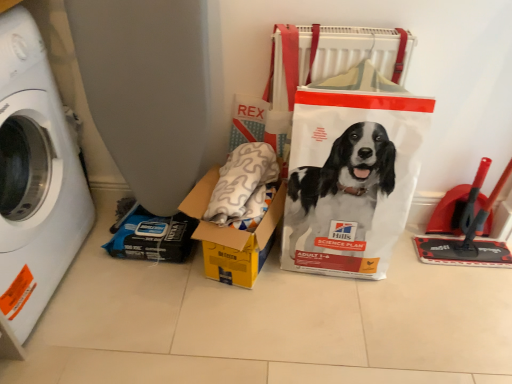
You are a GUI agent. You are given a task and a screenshot of the screen. Output one action in this format:
    pyautogui.click(x=<x>, y=<y>)
    Task: Click on the white plastic bag at center
    
    Given the screenshot: What is the action you would take?
    pyautogui.click(x=351, y=179)

At what (x,y) coordinates should I click in order to perform the action: click on yellow cardboard box at center. Please return your answer as a coordinate pair (x, y). Image resolution: width=512 pixels, height=384 pixels. Looking at the image, I should click on (239, 246).

Can we say yellow cardboard box at center lies outside white plastic bag at center?

Answer: Yes, yellow cardboard box at center is not within white plastic bag at center.

Does yellow cardboard box at center turn towards white plastic bag at center?

No, yellow cardboard box at center is not facing towards white plastic bag at center.

Does point (237, 242) come closer to viewer compared to point (370, 227)?

Yes, it is.

From a real-world perspective, is yellow cardboard box at center physically above white plastic bag at center?

Incorrect, from a real-world perspective, yellow cardboard box at center is lower than white plastic bag at center.

From the picture: Can you confirm if white plastic washing machine at left is thinner than white plastic bag at center?

No, white plastic washing machine at left is not thinner than white plastic bag at center.

Considering the relative positions of white plastic washing machine at left and white plastic bag at center in the image provided, is white plastic washing machine at left in front of white plastic bag at center?

Yes, white plastic washing machine at left is closer to the camera.

Choose the correct answer: Is white plastic washing machine at left inside white plastic bag at center or outside it?

white plastic washing machine at left is not inside white plastic bag at center, it's outside.

Locate an element on the screen. Image resolution: width=512 pixels, height=384 pixels. washing machine above the white plastic bag at center (from the image's perspective) is located at coordinates (34, 183).

Between white plastic bag at center and white plastic washing machine at left, which one appears on the left side from the viewer's perspective?

white plastic washing machine at left is more to the left.

From the picture: Can you see white plastic bag at center touching white plastic washing machine at left?

No, white plastic bag at center is not touching white plastic washing machine at left.

In the image, is white plastic bag at center positioned in front of or behind white plastic washing machine at left?

white plastic bag at center is behind white plastic washing machine at left.

Is white plastic bag at center situated inside white plastic washing machine at left or outside?

white plastic bag at center lies outside white plastic washing machine at left.

Between white plastic bag at center and yellow cardboard box at center, which one has smaller width?

With smaller width is white plastic bag at center.

Considering the sizes of objects white plastic bag at center and yellow cardboard box at center in the image provided, who is bigger, white plastic bag at center or yellow cardboard box at center?

With larger size is white plastic bag at center.

How much distance is there between white plastic bag at center and yellow cardboard box at center?

white plastic bag at center is 8.78 inches from yellow cardboard box at center.

Considering the points (345, 86) and (262, 226), which point is behind, point (345, 86) or point (262, 226)?

The point (262, 226) is farther from the camera.

Does yellow cardboard box at center lie behind white plastic washing machine at left?

Yes, yellow cardboard box at center is further from the viewer.

Considering the relative sizes of yellow cardboard box at center and white plastic washing machine at left in the image provided, is yellow cardboard box at center bigger than white plastic washing machine at left?

No, yellow cardboard box at center is not bigger than white plastic washing machine at left.

Which is more to the right, yellow cardboard box at center or white plastic washing machine at left?

yellow cardboard box at center.

How far apart are yellow cardboard box at center and white plastic washing machine at left?

yellow cardboard box at center and white plastic washing machine at left are 21.15 inches apart.

Locate an element on the screen. washing machine to the left of yellow cardboard box at center is located at coordinates (34, 183).

Considering the positions of objects white plastic washing machine at left and yellow cardboard box at center in the image provided, who is in front, white plastic washing machine at left or yellow cardboard box at center?

white plastic washing machine at left is more forward.

Considering the relative sizes of white plastic washing machine at left and yellow cardboard box at center in the image provided, is white plastic washing machine at left thinner than yellow cardboard box at center?

Incorrect, the width of white plastic washing machine at left is not less than that of yellow cardboard box at center.

From a real-world perspective, is white plastic washing machine at left positioned above or below yellow cardboard box at center?

Clearly, from a real-world perspective, white plastic washing machine at left is above yellow cardboard box at center.

Locate an element on the screen. The height and width of the screenshot is (384, 512). paper bag above the yellow cardboard box at center (from the image's perspective) is located at coordinates (351, 179).

Image resolution: width=512 pixels, height=384 pixels. Identify the location of washing machine that is above the white plastic bag at center (from a real-world perspective). (34, 183).

Based on their spatial positions, is white plastic bag at center or yellow cardboard box at center closer to white plastic washing machine at left?

yellow cardboard box at center.

Based on their spatial positions, is white plastic bag at center or white plastic washing machine at left closer to yellow cardboard box at center?

The object closer to yellow cardboard box at center is white plastic bag at center.

Based on their spatial positions, is white plastic washing machine at left or yellow cardboard box at center closer to white plastic bag at center?

The object closer to white plastic bag at center is yellow cardboard box at center.

From the picture: Estimate the real-world distances between objects in this image. Which object is further from white plastic washing machine at left, yellow cardboard box at center or white plastic bag at center?

The object further to white plastic washing machine at left is white plastic bag at center.

Estimate the real-world distances between objects in this image. Which object is further from yellow cardboard box at center, white plastic washing machine at left or white plastic bag at center?

white plastic washing machine at left is further to yellow cardboard box at center.

Looking at the image, which one is located closer to white plastic bag at center, yellow cardboard box at center or white plastic washing machine at left?

The object closer to white plastic bag at center is yellow cardboard box at center.

Where is `box between white plastic washing machine at left and white plastic bag at center`? box between white plastic washing machine at left and white plastic bag at center is located at coordinates (239, 246).